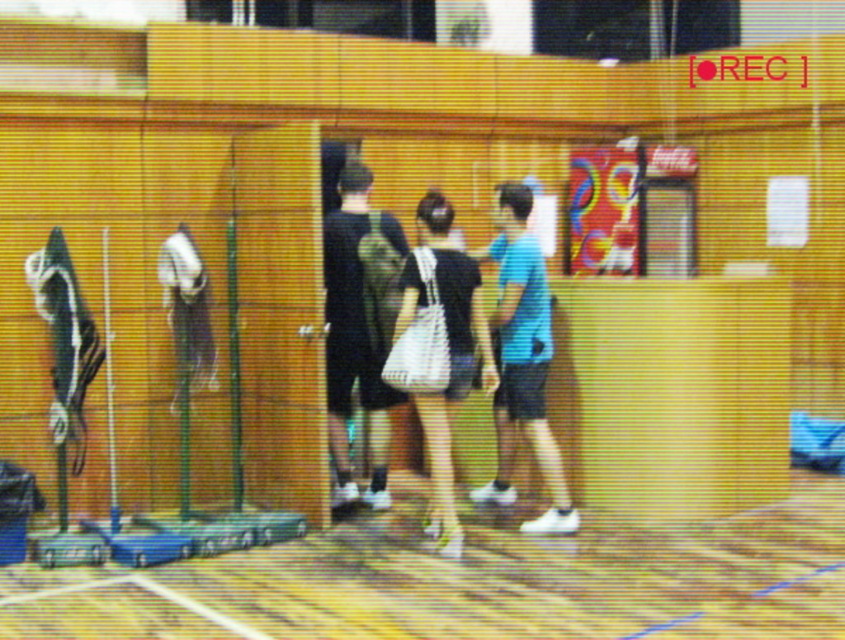
You are a security guard monitoring the gymnasium. You notice the yellow rubber court at center and the black matte bag at center. Which object is positioned lower in the image?

The yellow rubber court at center is positioned below the black matte bag at center, so it is lower in the image.

You are a security guard monitoring the gymnasium. You notice two items of clothing in the center area. The blue matte shirt at center and the black matte bag at center. According to the surveillance feed, which item is positioned to the right of the other?

The blue matte shirt at center is to the right of the black matte bag at center.

You are a security guard monitoring the gymnasium. You notice two items at the center of the frame. Which item is smaller in size between the dark green fabric backpack at center and the blue matte shirt at center?

The dark green fabric backpack at center is smaller in size compared to the blue matte shirt at center according to the description.